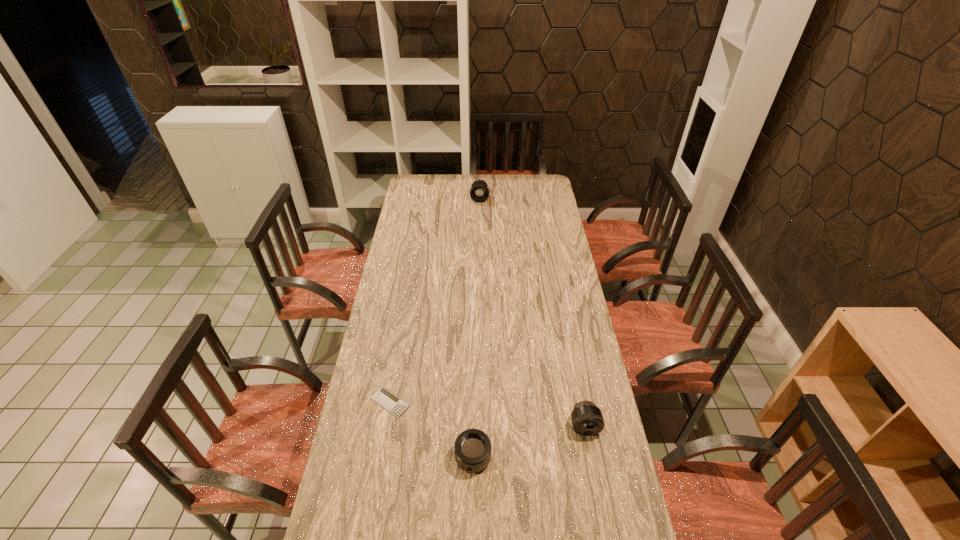
Identify the location of free space between the nearest telephoto lens and the rightmost telephoto lens. This screenshot has height=540, width=960. (529, 442).

Find the location of a particular element. free area in between the second farthest telephoto lens and the nearest object is located at coordinates (529, 442).

The height and width of the screenshot is (540, 960). I want to click on vacant area that lies between the third tallest object and the leftmost object, so click(431, 430).

Image resolution: width=960 pixels, height=540 pixels. Find the location of `free space between the calculator and the farthest telephoto lens`. free space between the calculator and the farthest telephoto lens is located at coordinates (435, 300).

I want to click on vacant area that lies between the shortest object and the nearest telephoto lens, so click(x=431, y=430).

This screenshot has height=540, width=960. I want to click on free space between the nearest object and the leftmost object, so click(431, 430).

Find the location of a particular element. This screenshot has width=960, height=540. free space that is in between the nearest telephoto lens and the leftmost object is located at coordinates (431, 430).

You are a GUI agent. You are given a task and a screenshot of the screen. Output one action in this format:
    pyautogui.click(x=<x>, y=<y>)
    Task: Click on the vacant space that's between the farthest telephoto lens and the second shortest object
    The width and height of the screenshot is (960, 540).
    Given the screenshot: What is the action you would take?
    pyautogui.click(x=476, y=328)

Locate an element on the screen. free space between the nearest object and the leftmost object is located at coordinates (431, 430).

Select which object appears as the second closest to the shortest object. Please provide its 2D coordinates. Your answer should be formatted as a tuple, i.e. [(x, y)], where the tuple contains the x and y coordinates of a point satisfying the conditions above.

[(587, 419)]